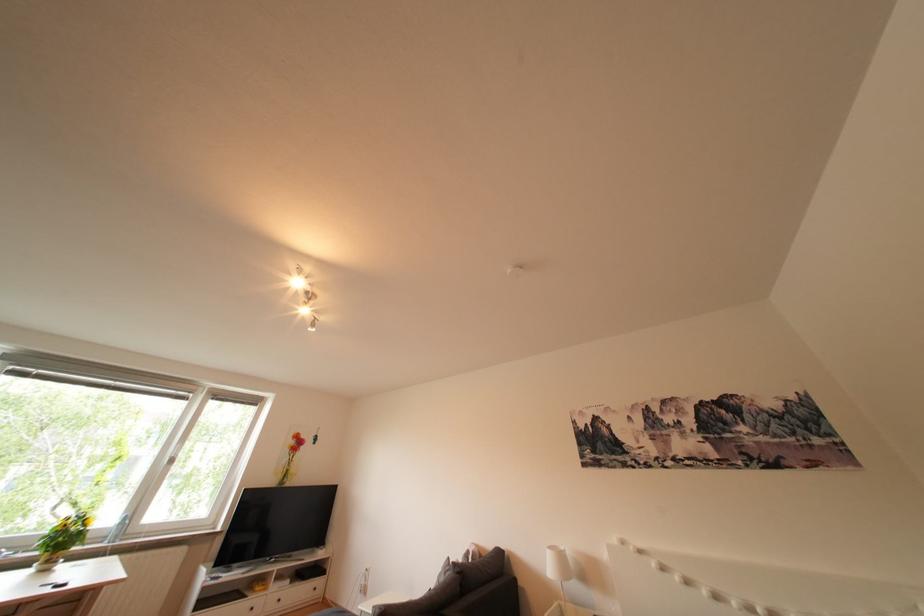
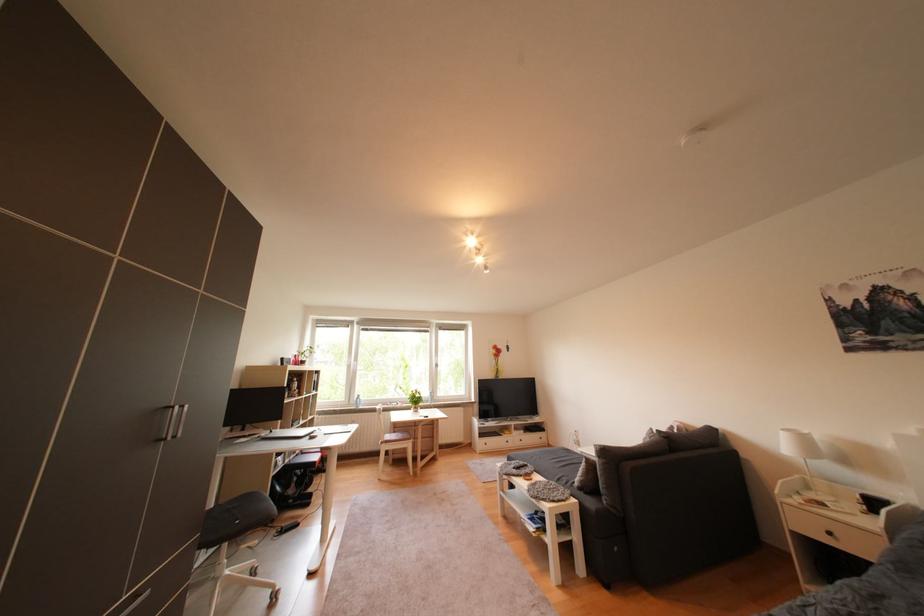
Question: The first image is from the beginning of the video and the second image is from the end. How did the camera likely rotate when shooting the video?

Choices:
 (A) Left
 (B) Right
 (C) Up
 (D) Down

Answer: (A)